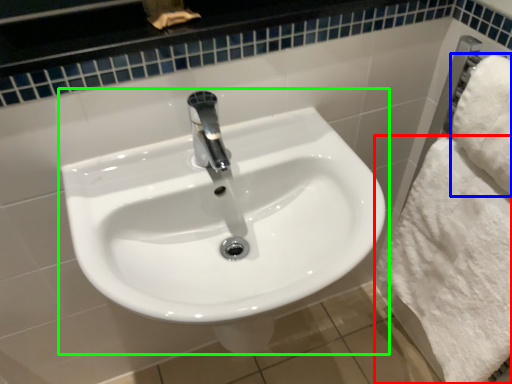
Question: Based on their relative distances, which object is nearer to bath towel (highlighted by a red box)? Choose from bath towel (highlighted by a blue box) and sink (highlighted by a green box).

Choices:
 (A) bath towel
 (B) sink

Answer: (A)